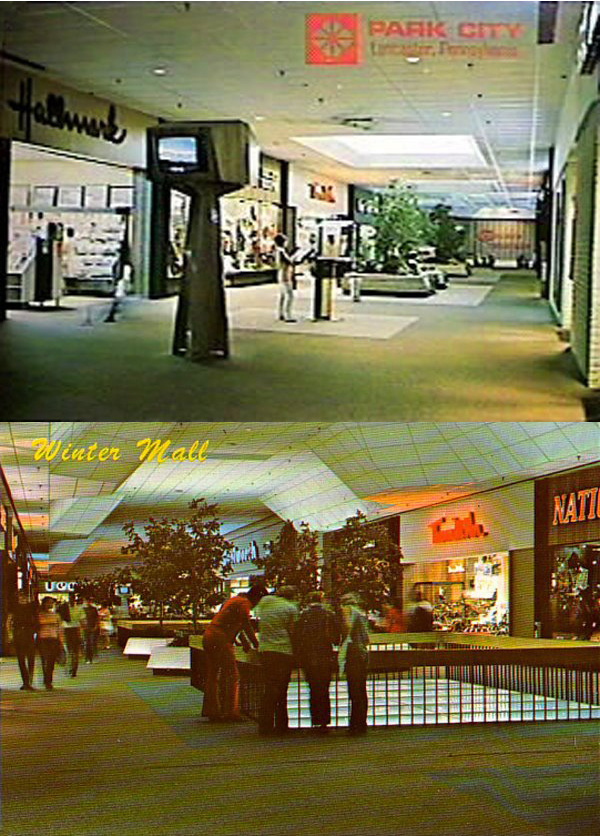
Where is `tv screen`? The image size is (600, 836). tv screen is located at coordinates (176, 155).